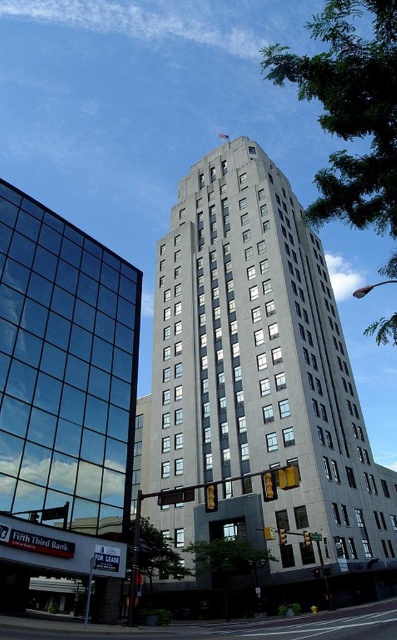
Is point (281, 244) closer to camera compared to point (115, 298)?

No, it is not.

Consider the image. Does gray concrete skyscraper at center have a greater width compared to transparent glass building at left?

Yes.

What do you see at coordinates (258, 378) in the screenshot?
I see `gray concrete skyscraper at center` at bounding box center [258, 378].

The image size is (397, 640). I want to click on gray concrete skyscraper at center, so click(x=258, y=378).